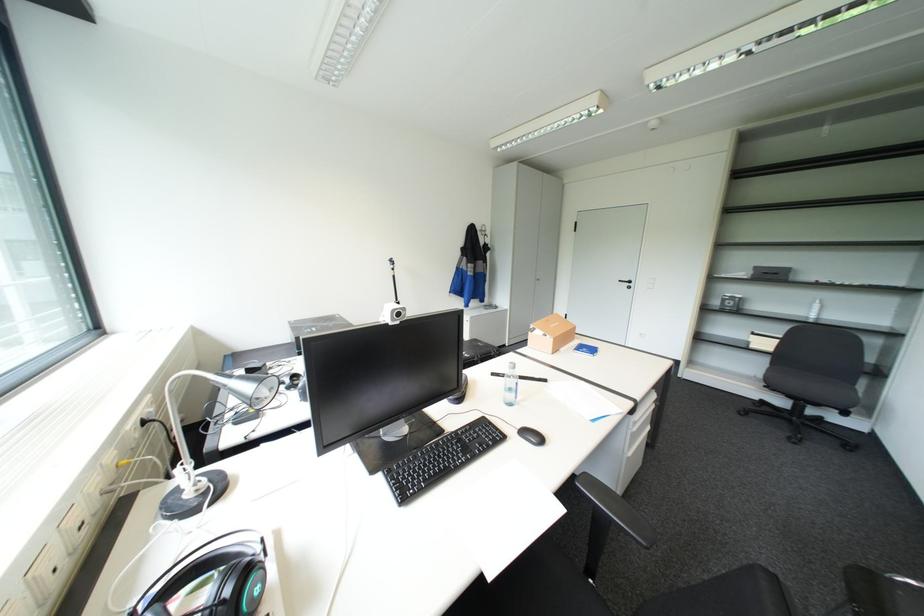
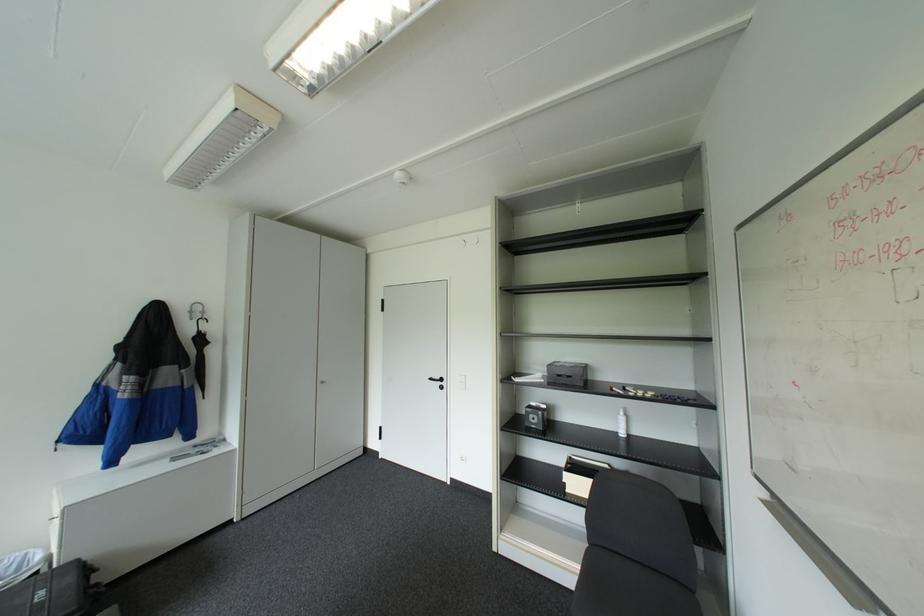
The point at (x=491, y=233) is marked in the first image. Where is the corresponding point in the second image?

(200, 318)